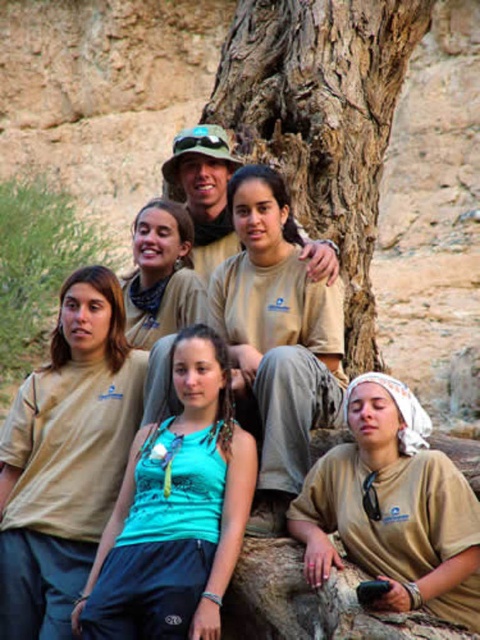
You are a photographer standing at the base of the brown rough bark tree at center. You want to take a photo of the group of six individuals who are standing 181.28 feet away from you. What is the minimum distance you need to move backward to ensure the entire group fits in your camera frame?

The minimum distance you need to move backward is 181.28 feet to ensure the entire group fits in your camera frame.

You are a photographer standing in front of the scene. You want to take a photo that includes both the brown rough bark tree at center and the beige cotton shirt at center. Which object should you focus on first to ensure both are in frame?

The brown rough bark tree at center is above the beige cotton shirt at center, so you should focus on the beige cotton shirt at center first to ensure both are in frame.

You are a photographer trying to frame a shot that includes both the brown rough bark tree at center and the matte khaki shirt at center. Which object should you adjust your camera angle to prioritize if you want to focus on the wider subject?

The brown rough bark tree at center is wider than the matte khaki shirt at center, so you should prioritize focusing on the brown rough bark tree at center to capture the wider subject.